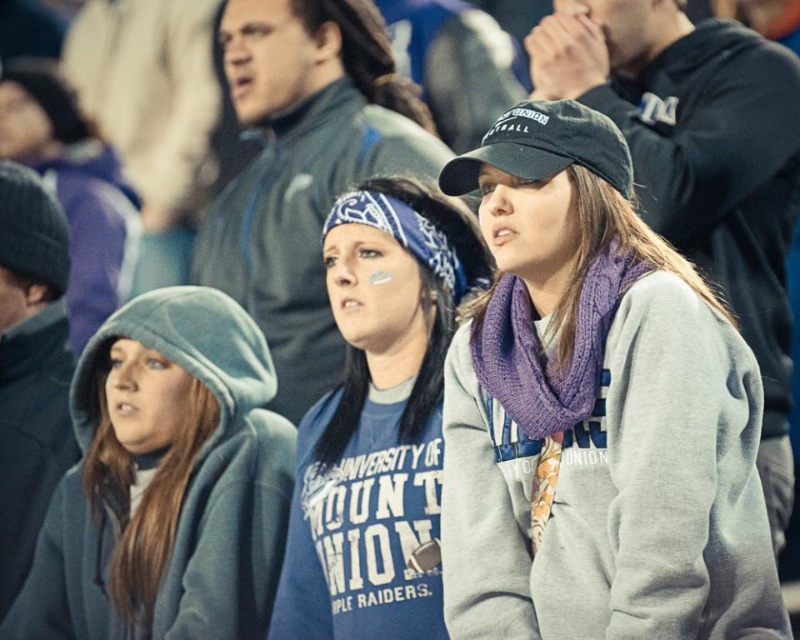
Question: Among these points, which one is farthest from the camera?

Choices:
 (A) (525, 465)
 (B) (380, 237)

Answer: (B)

Question: Is light blue fleece hoodie at lower left positioned before blue fabric shirt at center?

Choices:
 (A) yes
 (B) no

Answer: (B)

Question: Where is purple knit scarf at center located in relation to blue fabric shirt at center in the image?

Choices:
 (A) left
 (B) right

Answer: (B)

Question: Which of the following is the closest to the observer?

Choices:
 (A) (604, 307)
 (B) (206, 531)
 (C) (378, 381)

Answer: (A)

Question: Is light blue fleece hoodie at lower left closer to camera compared to blue fabric shirt at center?

Choices:
 (A) yes
 (B) no

Answer: (B)

Question: Which point is farther from the camera taking this photo?

Choices:
 (A) (80, 416)
 (B) (594, 429)

Answer: (A)